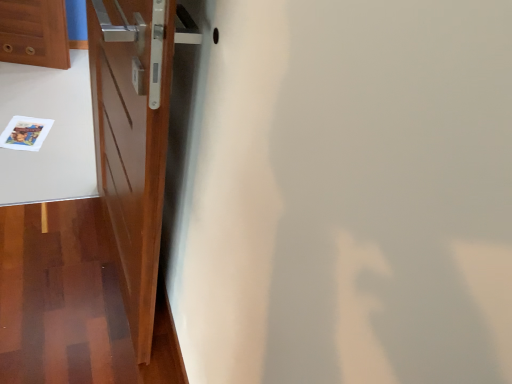
Question: Should I look upward or downward to see glossy wood door at left?

Choices:
 (A) up
 (B) down

Answer: (A)